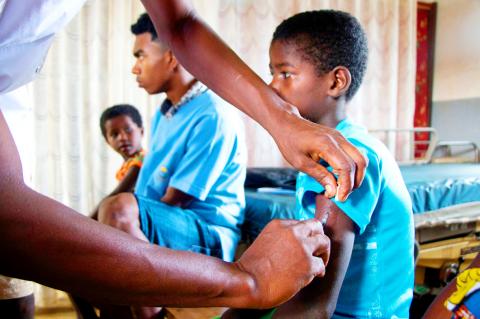
This screenshot has width=480, height=319. Identify the location of curtain. (394, 54).